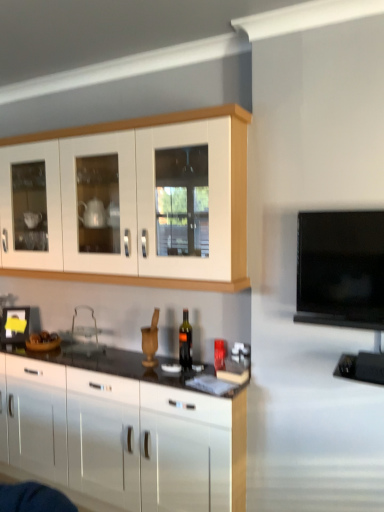
Question: Can you confirm if white glossy cabinet at upper left, positioned as the 2th cabinetry in bottom-to-top order, is bigger than dark glass bottle at center?

Choices:
 (A) yes
 (B) no

Answer: (A)

Question: From a real-world perspective, is white glossy cabinet at upper left, arranged as the 1th cabinetry when viewed from the top, on dark glass bottle at center?

Choices:
 (A) yes
 (B) no

Answer: (A)

Question: Does white glossy cabinet at upper left, positioned as the 2th cabinetry in bottom-to-top order, appear on the right side of dark glass bottle at center?

Choices:
 (A) yes
 (B) no

Answer: (B)

Question: Considering the relative positions of white glossy cabinet at upper left, positioned as the 2th cabinetry in bottom-to-top order, and dark glass bottle at center in the image provided, is white glossy cabinet at upper left, positioned as the 2th cabinetry in bottom-to-top order, to the left of dark glass bottle at center from the viewer's perspective?

Choices:
 (A) no
 (B) yes

Answer: (B)

Question: Is dark glass bottle at center completely or partially inside white glossy cabinet at upper left, arranged as the 1th cabinetry when viewed from the top?

Choices:
 (A) yes
 (B) no

Answer: (B)

Question: In the image, is dark glass bottle at center positioned in front of or behind glossy white cabinets at center, the first cabinetry ordered from the bottom?

Choices:
 (A) front
 (B) behind

Answer: (B)

Question: From the image's perspective, is dark glass bottle at center positioned above or below glossy white cabinets at center, the first cabinetry ordered from the bottom?

Choices:
 (A) above
 (B) below

Answer: (A)

Question: Is dark glass bottle at center wider or thinner than glossy white cabinets at center, placed as the 2th cabinetry when sorted from top to bottom?

Choices:
 (A) wide
 (B) thin

Answer: (B)

Question: Does point (183, 365) appear closer or farther from the camera than point (132, 506)?

Choices:
 (A) farther
 (B) closer

Answer: (A)

Question: Is glossy white cabinets at center, the first cabinetry ordered from the bottom, to the left or to the right of dark glass bottle at center in the image?

Choices:
 (A) right
 (B) left

Answer: (B)

Question: Considering the positions of glossy white cabinets at center, placed as the 2th cabinetry when sorted from top to bottom, and dark glass bottle at center in the image, is glossy white cabinets at center, placed as the 2th cabinetry when sorted from top to bottom, bigger or smaller than dark glass bottle at center?

Choices:
 (A) small
 (B) big

Answer: (B)

Question: Is glossy white cabinets at center, the first cabinetry ordered from the bottom, taller or shorter than dark glass bottle at center?

Choices:
 (A) short
 (B) tall

Answer: (B)

Question: From the image's perspective, relative to dark glass bottle at center, is glossy white cabinets at center, placed as the 2th cabinetry when sorted from top to bottom, above or below?

Choices:
 (A) below
 (B) above

Answer: (A)

Question: Considering the positions of flat screen tv at right and white glossy cabinet at upper left, arranged as the 1th cabinetry when viewed from the top, in the image, is flat screen tv at right bigger or smaller than white glossy cabinet at upper left, arranged as the 1th cabinetry when viewed from the top,?

Choices:
 (A) small
 (B) big

Answer: (A)

Question: From the image's perspective, is flat screen tv at right above or below white glossy cabinet at upper left, arranged as the 1th cabinetry when viewed from the top?

Choices:
 (A) above
 (B) below

Answer: (B)